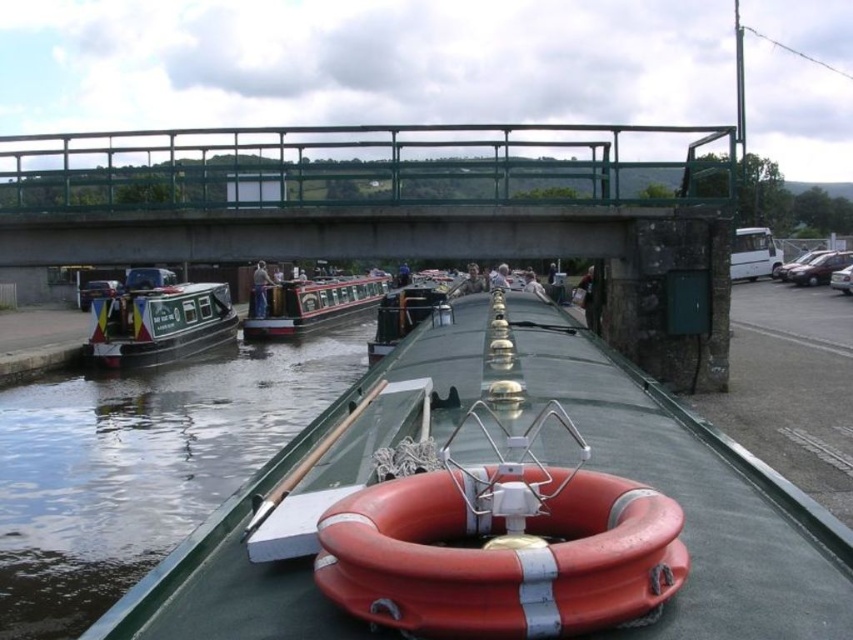
Can you confirm if green metal bridge at upper center is positioned to the right of polished wood canal boat at center?

Correct, you'll find green metal bridge at upper center to the right of polished wood canal boat at center.

Who is positioned more to the right, green metal bridge at upper center or polished wood canal boat at center?

Positioned to the right is green metal bridge at upper center.

Does point (451, 243) come closer to viewer compared to point (276, 300)?

That is True.

You are a GUI agent. You are given a task and a screenshot of the screen. Output one action in this format:
    pyautogui.click(x=<x>, y=<y>)
    Task: Click on the green metal bridge at upper center
    This screenshot has width=853, height=640.
    Given the screenshot: What is the action you would take?
    pyautogui.click(x=339, y=189)

Does point (834, 566) come behind point (352, 282)?

No, it is in front of (352, 282).

Who is shorter, orange rubber lifebuoy at center or polished wood canal boat at center?

Standing shorter between the two is orange rubber lifebuoy at center.

Find the location of a particular element. orange rubber lifebuoy at center is located at coordinates (498, 516).

Can you confirm if orange rubber lifebuoy at center is taller than green painted wood canal boat at left?

No.

Who is more forward, (228, 524) or (165, 330)?

Point (228, 524) is more forward.

Find the location of a particular element. The image size is (853, 640). orange rubber lifebuoy at center is located at coordinates (498, 516).